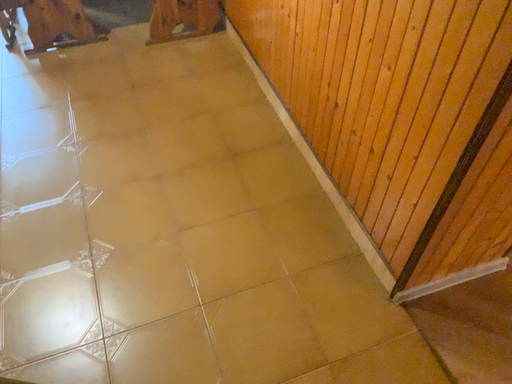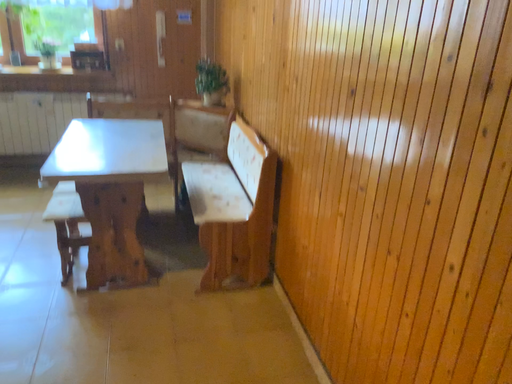
Question: How did the camera likely rotate when shooting the video?

Choices:
 (A) rotated upward
 (B) rotated downward

Answer: (A)